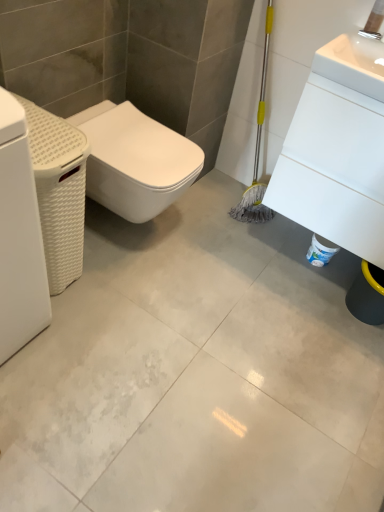
Question: Is white glossy sink at upper right, the 2th porcelain positioned from the left, completely or partially inside white glossy concrete at center?

Choices:
 (A) yes
 (B) no

Answer: (B)

Question: From a real-world perspective, is white glossy concrete at center physically below white glossy sink at upper right, placed as the first porcelain when sorted from right to left?

Choices:
 (A) no
 (B) yes

Answer: (B)

Question: From the image's perspective, is white glossy concrete at center on white glossy sink at upper right, the 2th porcelain positioned from the left?

Choices:
 (A) yes
 (B) no

Answer: (B)

Question: Are white glossy concrete at center and white glossy sink at upper right, placed as the first porcelain when sorted from right to left, located far from each other?

Choices:
 (A) no
 (B) yes

Answer: (A)

Question: Considering the relative sizes of white glossy concrete at center and white glossy sink at upper right, placed as the first porcelain when sorted from right to left, in the image provided, is white glossy concrete at center smaller than white glossy sink at upper right, placed as the first porcelain when sorted from right to left,?

Choices:
 (A) yes
 (B) no

Answer: (A)

Question: Is white glossy concrete at center at the right side of white glossy sink at upper right, the 2th porcelain positioned from the left?

Choices:
 (A) no
 (B) yes

Answer: (A)

Question: Is white woven basket at left, the first porcelain viewed from the left, not inside white matte washing machine at left?

Choices:
 (A) yes
 (B) no

Answer: (A)

Question: Is white woven basket at left, the first porcelain viewed from the left, thinner than white matte washing machine at left?

Choices:
 (A) no
 (B) yes

Answer: (A)

Question: Are white woven basket at left, the first porcelain viewed from the left, and white matte washing machine at left far apart?

Choices:
 (A) yes
 (B) no

Answer: (B)

Question: From a real-world perspective, is white woven basket at left, the first porcelain viewed from the left, on white matte washing machine at left?

Choices:
 (A) no
 (B) yes

Answer: (A)

Question: Considering the relative positions of white woven basket at left, the first porcelain viewed from the left, and white matte washing machine at left in the image provided, is white woven basket at left, the first porcelain viewed from the left, to the right of white matte washing machine at left from the viewer's perspective?

Choices:
 (A) yes
 (B) no

Answer: (A)

Question: Is white woven basket at left, placed as the 2th porcelain when sorted from right to left, facing towards white matte washing machine at left?

Choices:
 (A) no
 (B) yes

Answer: (A)

Question: Does white matte washing machine at left appear on the left side of white woven basket at left, placed as the 2th porcelain when sorted from right to left?

Choices:
 (A) no
 (B) yes

Answer: (B)